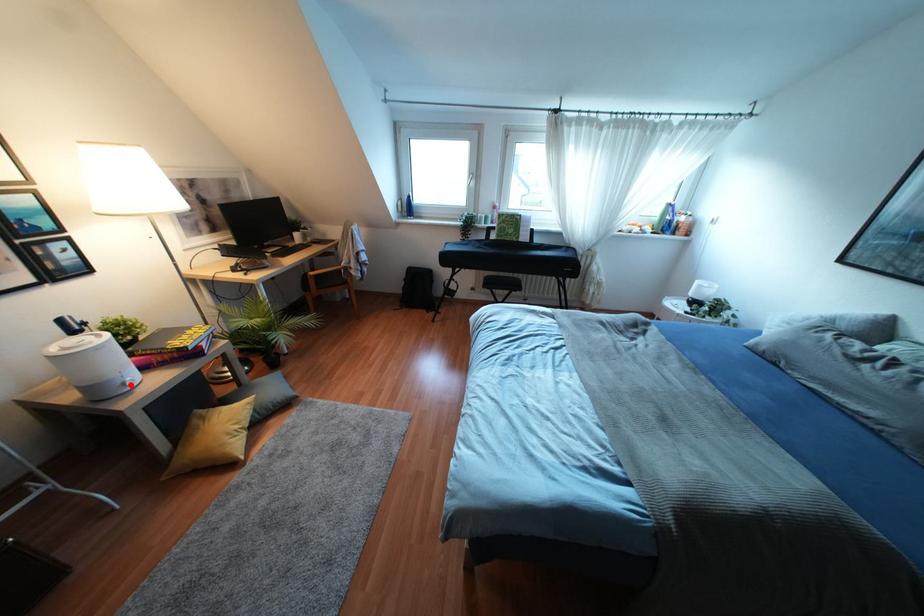
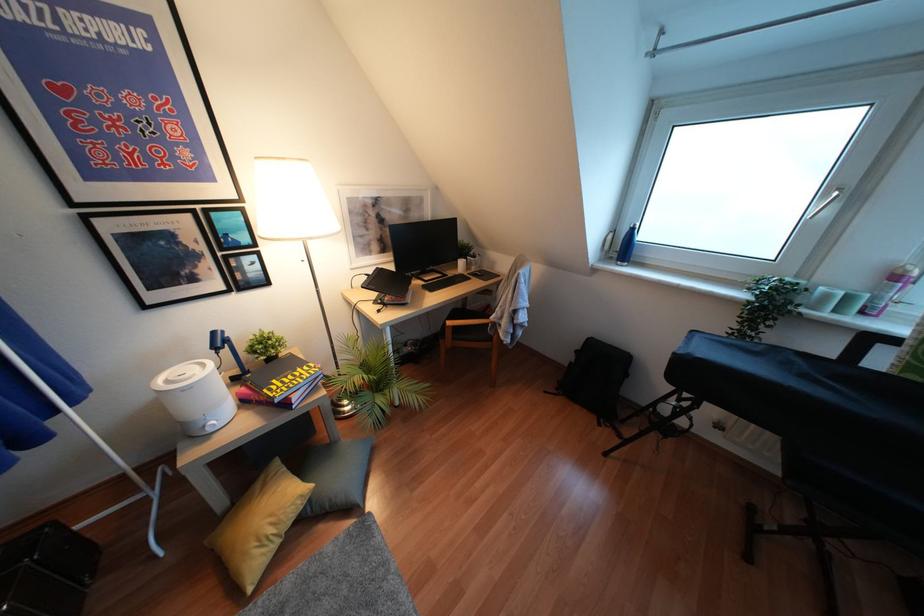
Question: I am providing you with two images of the same scene from different viewpoints. Image1 has a red point marked. In image2, the corresponding 3D location appears at what relative position? Reply with the corresponding letter.

Choices:
 (A) Closer
 (B) Farther

Answer: (A)